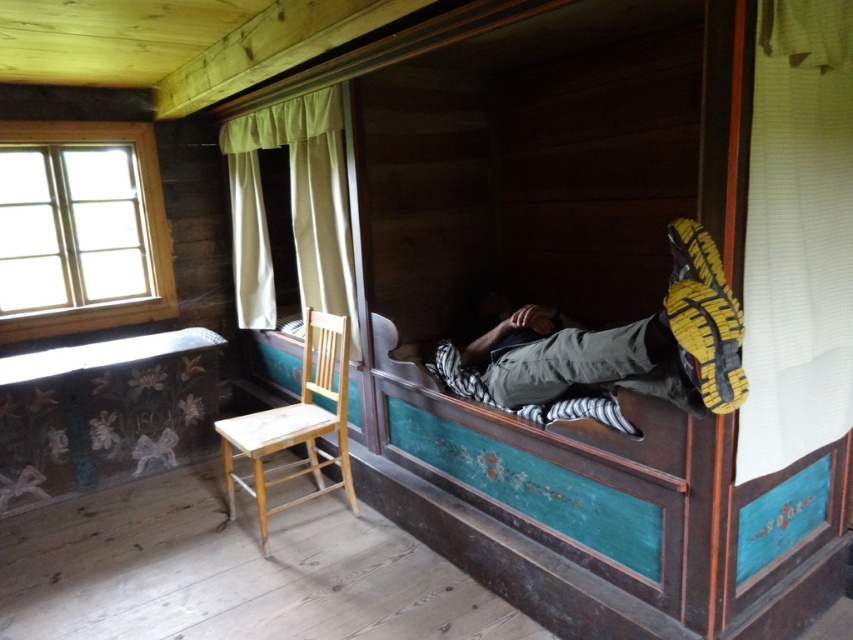
Is gray fabric pants at center shorter than green fabric curtain at upper center?

Yes.

Between gray fabric pants at center and green fabric curtain at upper center, which one appears on the right side from the viewer's perspective?

gray fabric pants at center

Is point (737, 365) positioned after point (241, 172)?

No, it is in front of (241, 172).

The width and height of the screenshot is (853, 640). What are the coordinates of `gray fabric pants at center` in the screenshot? It's located at (628, 342).

Does green fabric curtain at upper center have a larger size compared to light brown wooden chair at left?

Indeed, green fabric curtain at upper center has a larger size compared to light brown wooden chair at left.

Between point (250, 275) and point (299, 470), which one is positioned behind?

The point (250, 275) is behind.

You are a GUI agent. You are given a task and a screenshot of the screen. Output one action in this format:
    pyautogui.click(x=<x>, y=<y>)
    Task: Click on the green fabric curtain at upper center
    Image resolution: width=853 pixels, height=640 pixels.
    Given the screenshot: What is the action you would take?
    pyautogui.click(x=292, y=209)

Which of these two, gray fabric pants at center or light brown wooden chair at left, stands taller?

With more height is light brown wooden chair at left.

Measure the distance from gray fabric pants at center to light brown wooden chair at left.

gray fabric pants at center and light brown wooden chair at left are 39.04 inches apart.

Where is `gray fabric pants at center`? gray fabric pants at center is located at coordinates (628, 342).